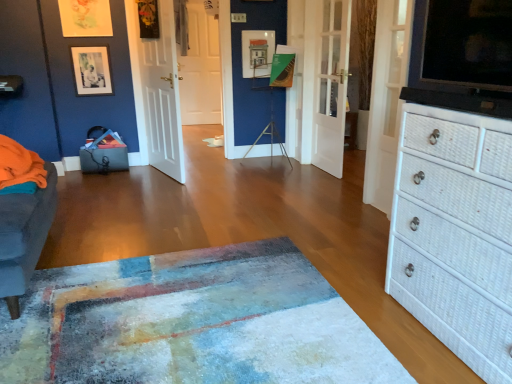
Find the location of a particular element. This screenshot has height=384, width=512. free space between white wicker chest of drawers at right and white wooden door at left, placed as the fourth door when sorted from right to left is located at coordinates (287, 230).